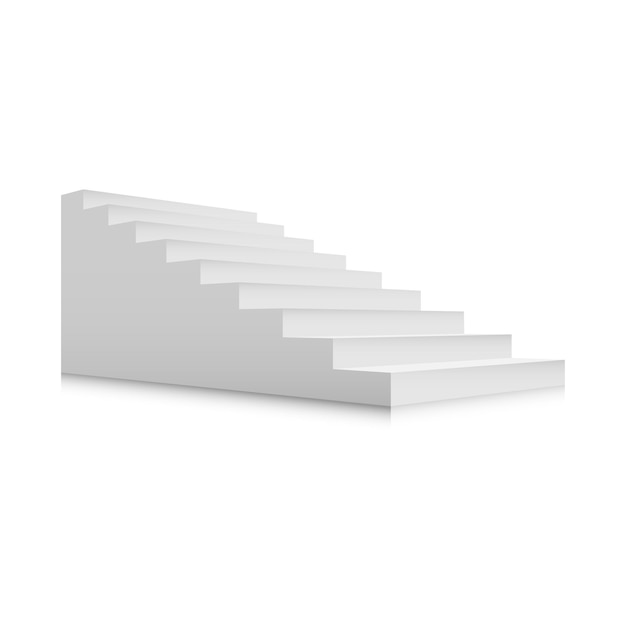
Image resolution: width=626 pixels, height=626 pixels. I want to click on corners of the steps where the steps meet, so click(81, 191), click(108, 206), click(135, 222), click(163, 240), click(198, 260), click(237, 285), click(280, 309), click(330, 339), click(389, 371).